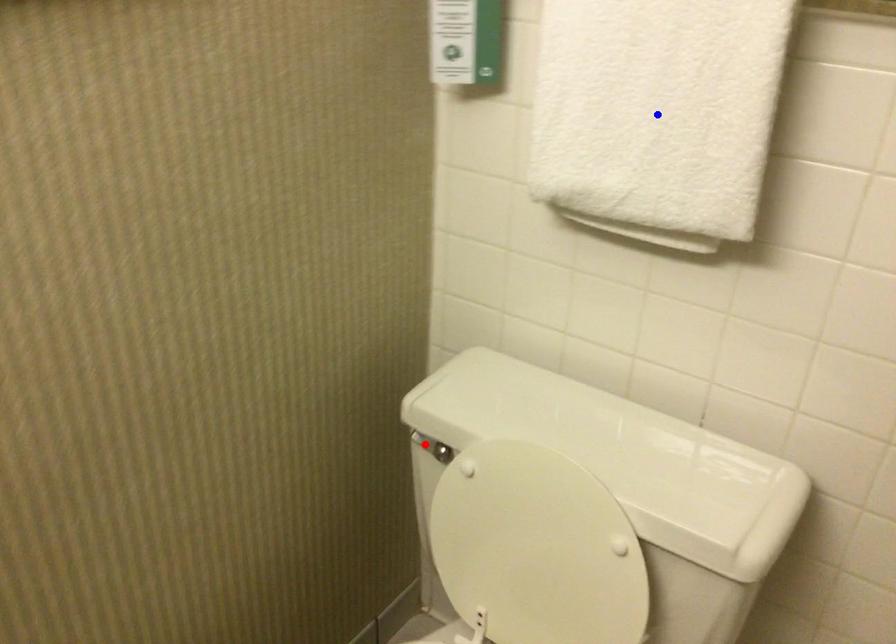
Question: Which of the two points in the image is closer to the camera?

Choices:
 (A) Blue point is closer.
 (B) Red point is closer.

Answer: (A)